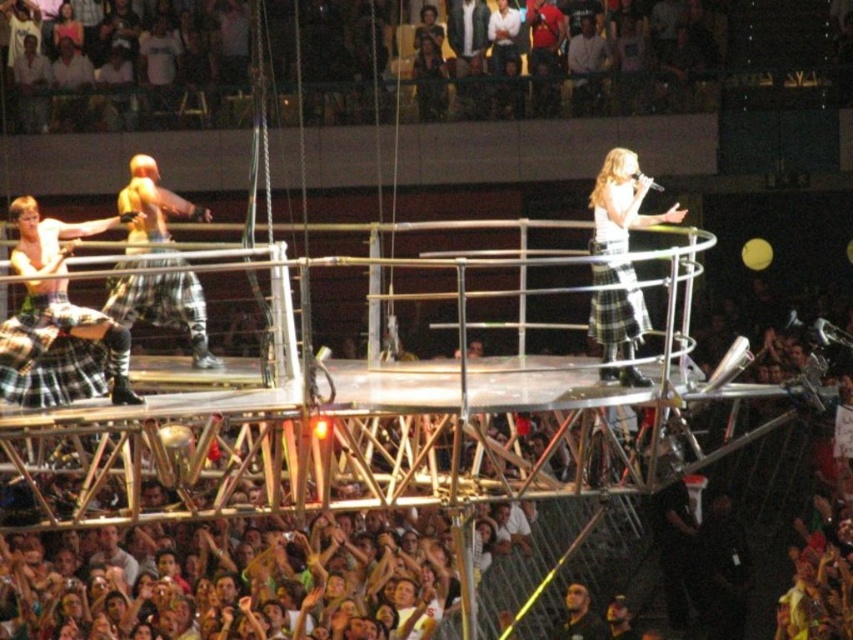
Which of these two, matte plaid kilt at center or dark brown leather jacket at lower center, stands shorter?

dark brown leather jacket at lower center

Is the position of matte plaid kilt at center more distant than that of dark brown leather jacket at lower center?

No, it is not.

Locate an element on the screen. This screenshot has width=853, height=640. matte plaid kilt at center is located at coordinates (164, 307).

Who is positioned more to the right, plaid skirt at center or matte plaid kilt at center?

plaid skirt at center

The image size is (853, 640). Find the location of `plaid skirt at center`. plaid skirt at center is located at coordinates (621, 202).

At what (x,y) coordinates should I click in order to perform the action: click on plaid skirt at center. Please return your answer as a coordinate pair (x, y). The image size is (853, 640). Looking at the image, I should click on (621, 202).

Between plaid skirt at center and dark brown leather jacket at lower center, which one is positioned lower?

dark brown leather jacket at lower center is below.

Is plaid skirt at center behind dark brown leather jacket at lower center?

No.

Is point (596, 296) positioned in front of point (561, 637)?

Yes.

This screenshot has height=640, width=853. Find the location of `plaid skirt at center`. plaid skirt at center is located at coordinates (621, 202).